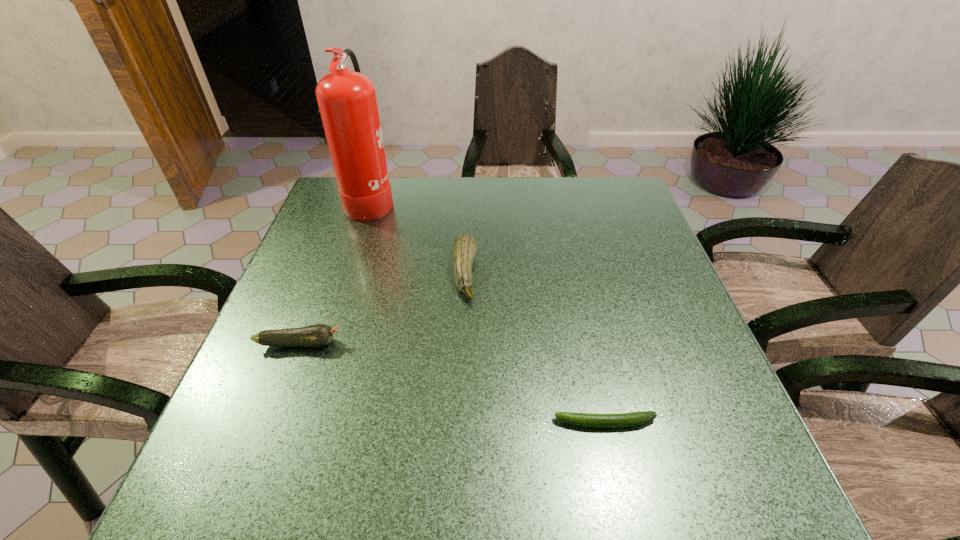
Identify the location of vacant position located 0.380m at the blossom end of the second shortest object. (524, 343).

Find the location of a particular element. free space located 0.350m on the front-facing side of the rightmost object is located at coordinates (358, 423).

I want to click on vacant space situated on the front-facing side of the rightmost object, so click(470, 423).

In order to click on free space located 0.200m on the front-facing side of the rightmost object in this screenshot , I will do `click(442, 423)`.

Find the location of a particular element. The width and height of the screenshot is (960, 540). object positioned at the far edge is located at coordinates (347, 101).

At what (x,y) coordinates should I click in order to perform the action: click on fire extinguisher positioned at the left edge. Please return your answer as a coordinate pair (x, y). This screenshot has width=960, height=540. Looking at the image, I should click on (347, 101).

Where is `zucchini that is at the left edge`? The image size is (960, 540). zucchini that is at the left edge is located at coordinates (318, 335).

Locate an element on the screen. object present at the right edge is located at coordinates (620, 420).

You are a GUI agent. You are given a task and a screenshot of the screen. Output one action in this format:
    pyautogui.click(x=<x>, y=<y>)
    Task: Click on the object that is at the far left corner
    This screenshot has height=540, width=960.
    Given the screenshot: What is the action you would take?
    pyautogui.click(x=347, y=101)

Find the location of a particular element. The image size is (960, 540). vacant space at the far edge of the desktop is located at coordinates (414, 181).